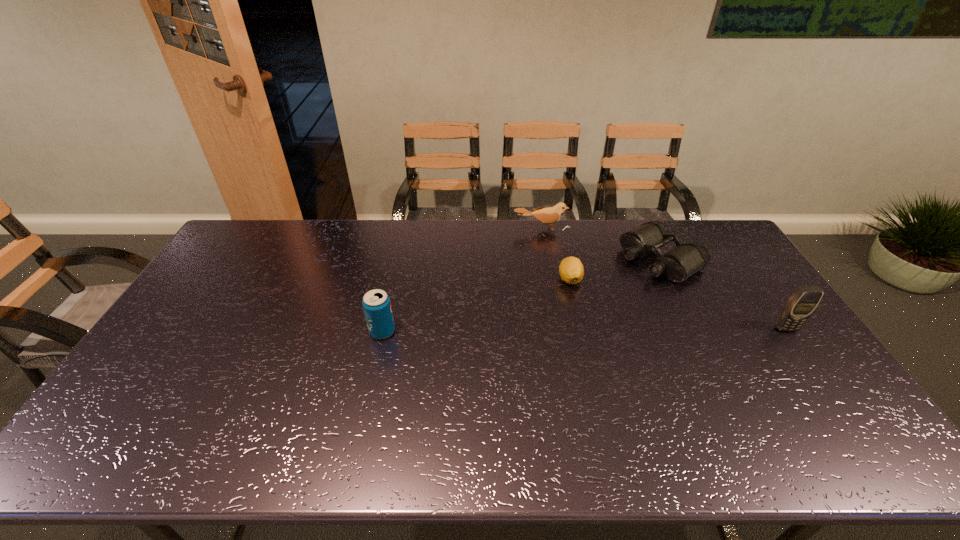
Where is `bird present at the far edge`? The image size is (960, 540). bird present at the far edge is located at coordinates (550, 215).

I want to click on cellular telephone at the right edge, so click(802, 303).

In order to click on binoculars present at the right edge in this screenshot , I will do `click(678, 264)`.

You are a GUI agent. You are given a task and a screenshot of the screen. Output one action in this format:
    pyautogui.click(x=<x>, y=<y>)
    Task: Click on the object that is at the far right corner
    
    Given the screenshot: What is the action you would take?
    pyautogui.click(x=678, y=264)

Locate an element on the screen. This screenshot has height=540, width=960. blank space at the far edge of the desktop is located at coordinates (581, 255).

The height and width of the screenshot is (540, 960). I want to click on blank area at the near edge, so click(x=646, y=397).

This screenshot has height=540, width=960. What are the coordinates of `free location at the left edge` in the screenshot? It's located at (220, 294).

This screenshot has height=540, width=960. In the image, there is a desktop. In order to click on vacant space at the right edge in this screenshot , I will do pyautogui.click(x=806, y=378).

Locate an element on the screen. vacant space at the far right corner of the desktop is located at coordinates (680, 223).

Find the location of `free space between the cellular telephone and the bird`. free space between the cellular telephone and the bird is located at coordinates (663, 279).